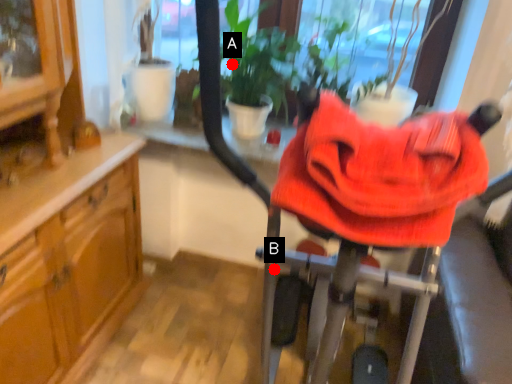
Question: Two points are circled on the image, labeled by A and B beside each circle. Which point is closer to the camera?

Choices:
 (A) A is closer
 (B) B is closer

Answer: (B)